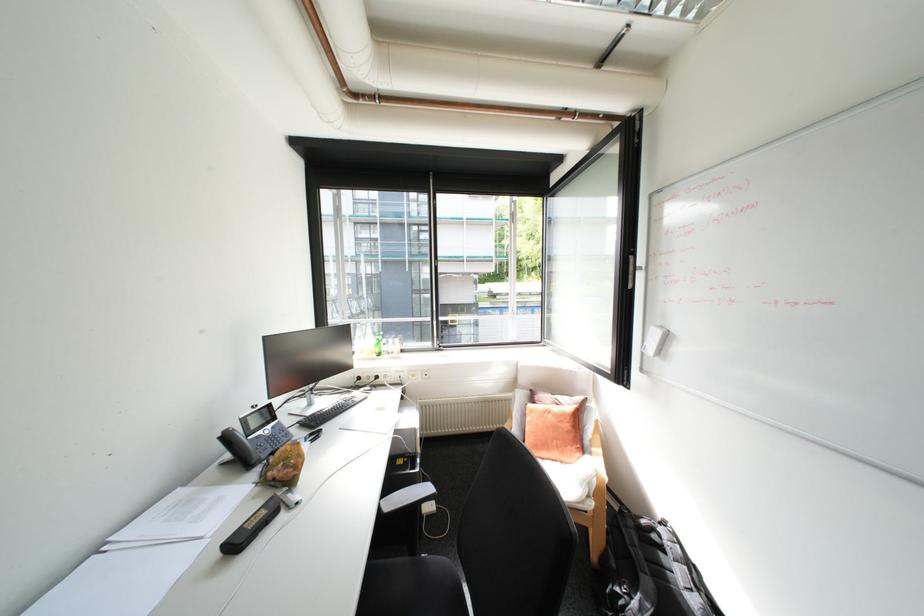
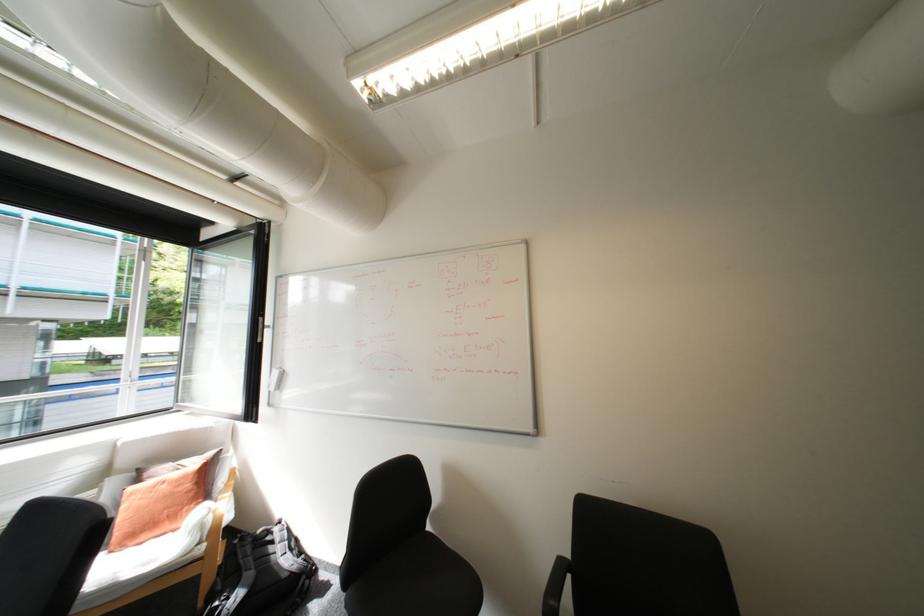
In the second image, find the point that corresponds to (x=561, y=416) in the first image.

(175, 485)